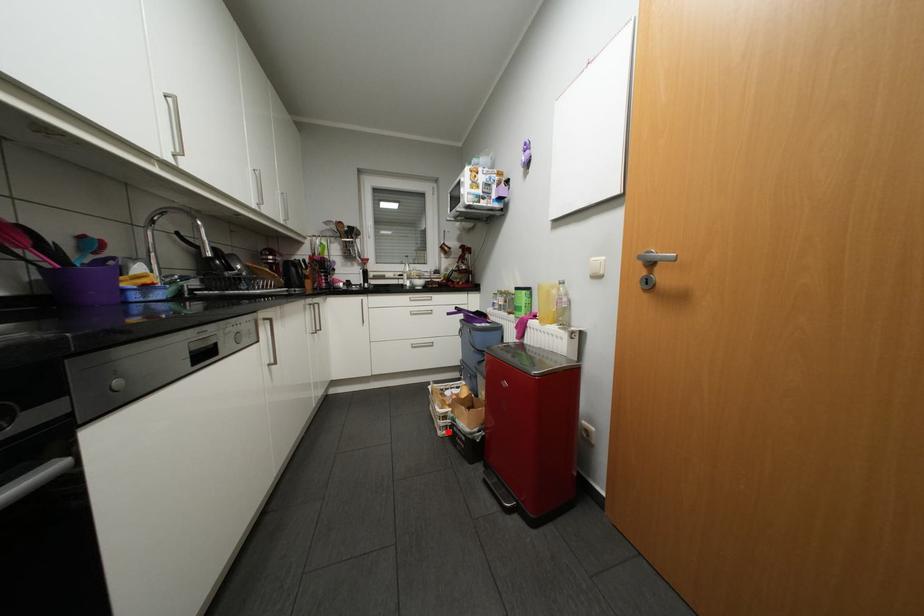
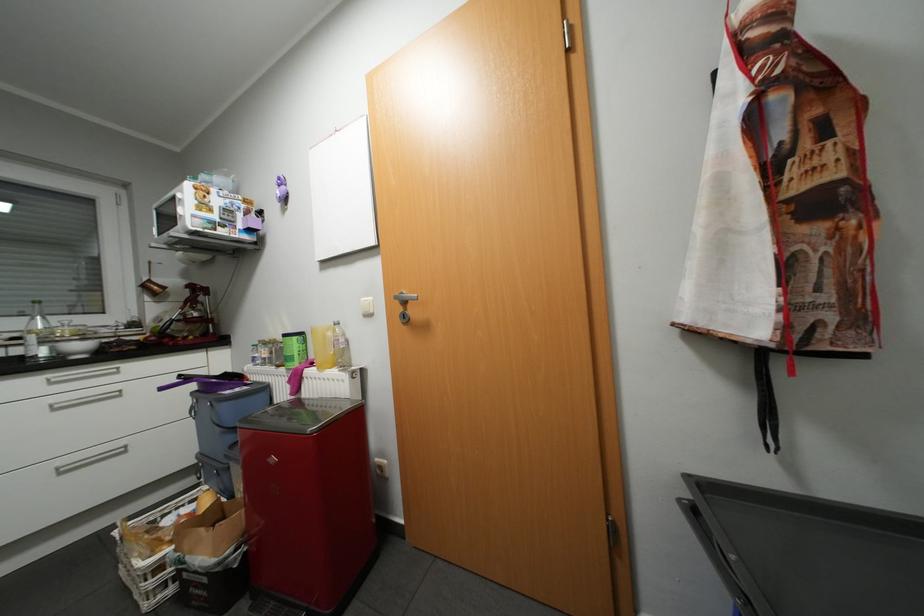
Question: I am providing you with two images of the same scene from different viewpoints. Given a red point in image1, look at the same physical point in image2. Is it:

Choices:
 (A) Closer to the viewpoint
 (B) Farther from the viewpoint

Answer: (A)